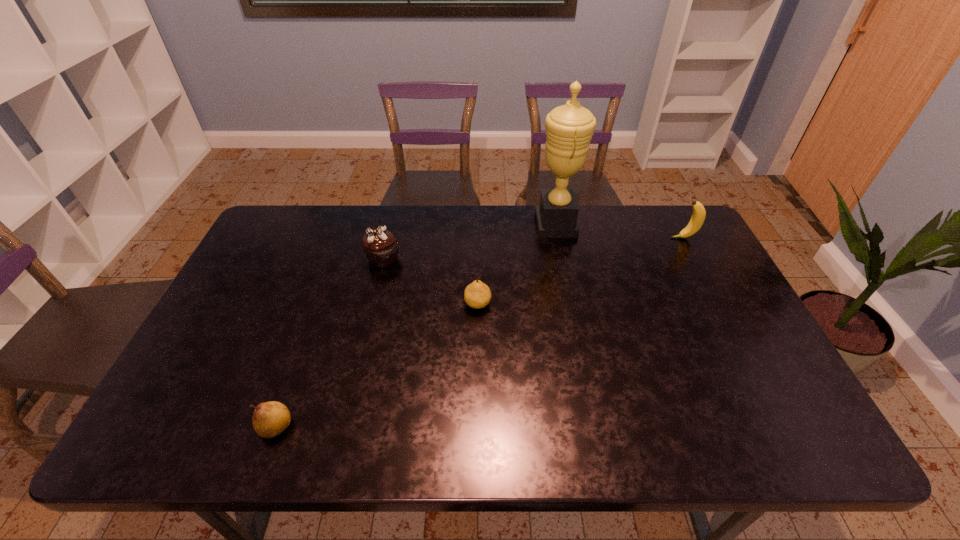
You are a GUI agent. You are given a task and a screenshot of the screen. Output one action in this format:
    pyautogui.click(x=<x>, y=<y>)
    Task: Click on the fourth object from left to right
    
    Given the screenshot: What is the action you would take?
    pyautogui.click(x=569, y=128)

Find the location of a particular element. The height and width of the screenshot is (540, 960). the tallest object is located at coordinates coord(569,128).

Locate an element on the screen. The image size is (960, 540). banana is located at coordinates (698, 216).

You are a GUI agent. You are given a task and a screenshot of the screen. Output one action in this format:
    pyautogui.click(x=<x>, y=<y>)
    Task: Click on the rightmost object
    This screenshot has width=960, height=540.
    Given the screenshot: What is the action you would take?
    pyautogui.click(x=698, y=216)

Identify the location of the second object from left to right. (380, 246).

Find the location of a particular element. the third farthest object is located at coordinates (380, 246).

This screenshot has height=540, width=960. In order to click on the right pear in this screenshot , I will do `click(477, 295)`.

Locate an element on the screen. The width and height of the screenshot is (960, 540). the second nearest object is located at coordinates (477, 295).

Image resolution: width=960 pixels, height=540 pixels. I want to click on the nearest object, so click(270, 419).

This screenshot has width=960, height=540. Find the location of `the nearer pear`. the nearer pear is located at coordinates (270, 419).